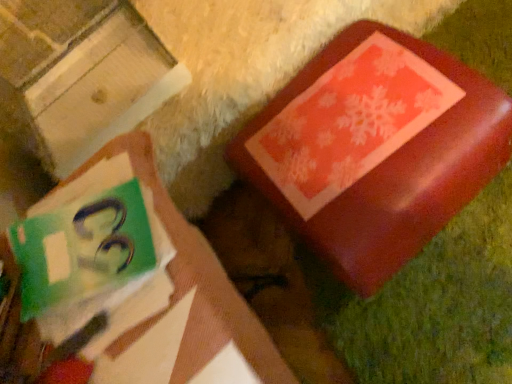
Question: Is shiny red box at upper right in front of or behind matte red box at upper right in the image?

Choices:
 (A) front
 (B) behind

Answer: (B)

Question: In terms of size, does shiny red box at upper right appear bigger or smaller than matte red box at upper right?

Choices:
 (A) small
 (B) big

Answer: (B)

Question: Based on their relative distances, which object is nearer to the shiny red box at upper right?

Choices:
 (A) matte green book at upper left
 (B) matte red box at upper right

Answer: (A)

Question: Estimate the real-world distances between objects in this image. Which object is closer to the matte red box at upper right?

Choices:
 (A) matte green book at upper left
 (B) shiny red box at upper right

Answer: (B)